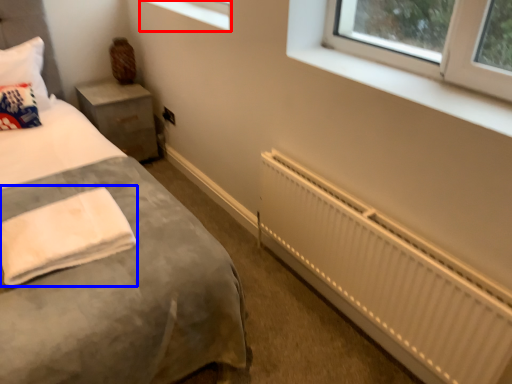
Question: Which point is closer to the camera, window (highlighted by a red box) or cloth (highlighted by a blue box)?

Choices:
 (A) window
 (B) cloth

Answer: (B)